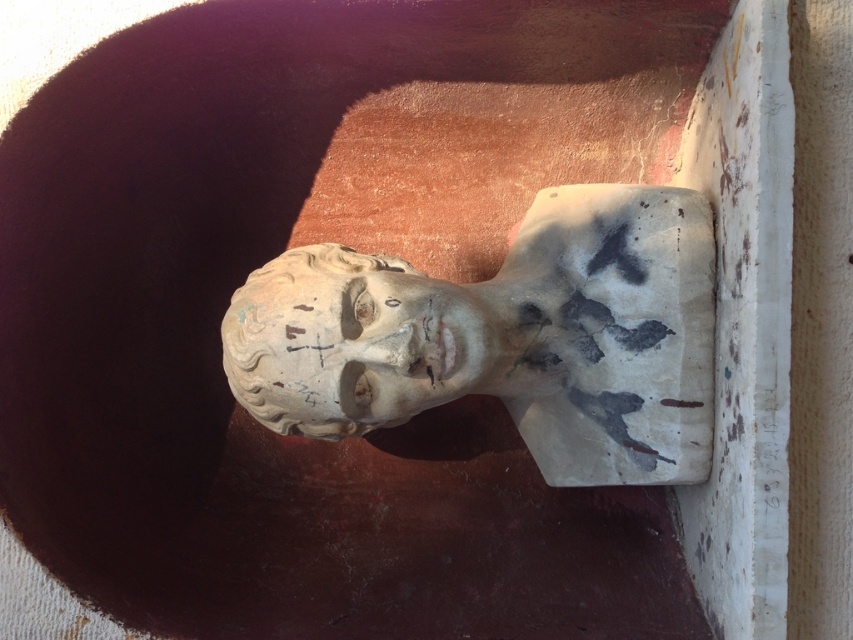
Question: Can you confirm if white plaster bust at center is positioned to the left of white stone bust at center?

Choices:
 (A) yes
 (B) no

Answer: (B)

Question: Is white plaster bust at center above white stone bust at center?

Choices:
 (A) yes
 (B) no

Answer: (A)

Question: Can you confirm if white plaster bust at center is positioned below white stone bust at center?

Choices:
 (A) yes
 (B) no

Answer: (B)

Question: Which point is farther to the camera?

Choices:
 (A) (337, 317)
 (B) (248, 410)

Answer: (B)